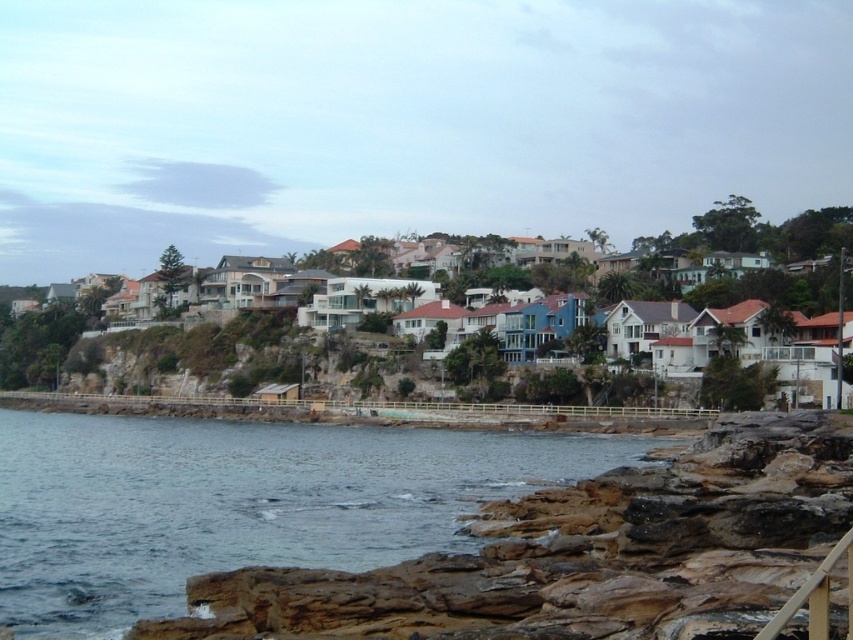
You are standing on the viewing platform near the wooden railing and want to take a photo of both the blue water at lower left and the white matte houses at center. Which object should you focus on first to ensure both are in the frame?

You should focus on the blue water at lower left first because it is closer to the viewer than the white matte houses at center, so adjusting the focus from near to far will help capture both in the frame.

You are a photographer planning to capture the entire scene in one shot. Given that the blue water at lower left and the white matte houses at center are both in your frame, which object would occupy a larger portion of the photo?

The white matte houses at center occupy a larger portion of the photo because the blue water at lower left is smaller than them according to the description.

You are standing on the viewing platform near the wooden railing and want to take a photo of the white matte houses at center and the blue water at lower left. Which object should you point your camera towards first to capture both in the frame?

You should point your camera towards the white matte houses at center first because the blue water at lower left is positioned under them, so adjusting the angle to include the lower area will also capture the blue water at lower left.